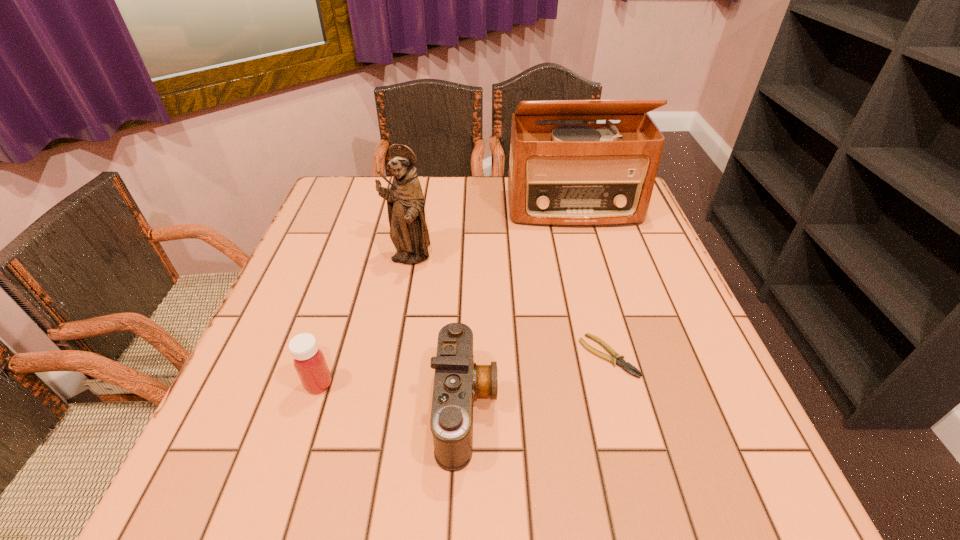
Locate which object is the second closest to the radio receiver. Please provide its 2D coordinates. Your answer should be formatted as a tuple, i.e. [(x, y)], where the tuple contains the x and y coordinates of a point satisfying the conditions above.

[(617, 359)]

Where is `the second closest object to the fourth nearest object`? This screenshot has height=540, width=960. the second closest object to the fourth nearest object is located at coordinates (458, 380).

You are a GUI agent. You are given a task and a screenshot of the screen. Output one action in this format:
    pyautogui.click(x=<x>, y=<y>)
    Task: Click on the free spot that satisfies the following two spatial constraints: 1. on the front-facing side of the figurine; 2. on the right side of the shortest object
    Image resolution: width=960 pixels, height=540 pixels.
    Given the screenshot: What is the action you would take?
    pyautogui.click(x=391, y=356)

This screenshot has height=540, width=960. I want to click on free space in the image that satisfies the following two spatial constraints: 1. on the front panel of the farthest object; 2. on the lens of the camera, so click(x=631, y=407).

Find the location of a particular element. vacant space that satisfies the following two spatial constraints: 1. on the back side of the shortest object; 2. on the left side of the medicine is located at coordinates (327, 356).

Where is `vacant position in the image that satisfies the following two spatial constraints: 1. on the front-facing side of the fourth object from right to left; 2. on the right side of the pliers`? Image resolution: width=960 pixels, height=540 pixels. vacant position in the image that satisfies the following two spatial constraints: 1. on the front-facing side of the fourth object from right to left; 2. on the right side of the pliers is located at coordinates (391, 356).